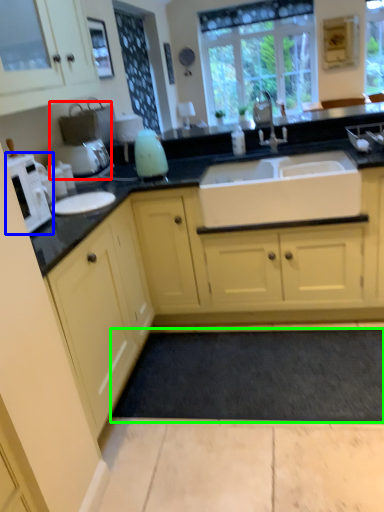
Question: Based on their relative distances, which object is nearer to coffee machine (highlighted by a red box)? Choose from microwave (highlighted by a blue box) and plain (highlighted by a green box).

Choices:
 (A) microwave
 (B) plain

Answer: (A)